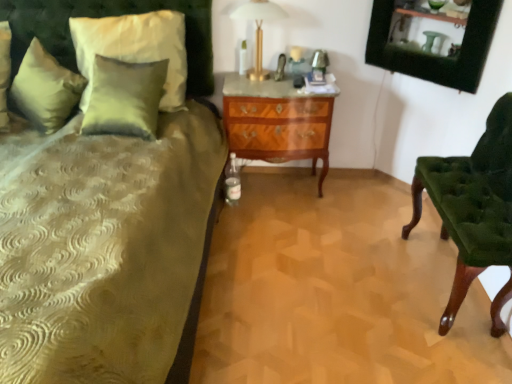
Locate an element on the screen. The image size is (512, 384). vacant space to the left of velvet green chair at right is located at coordinates (354, 282).